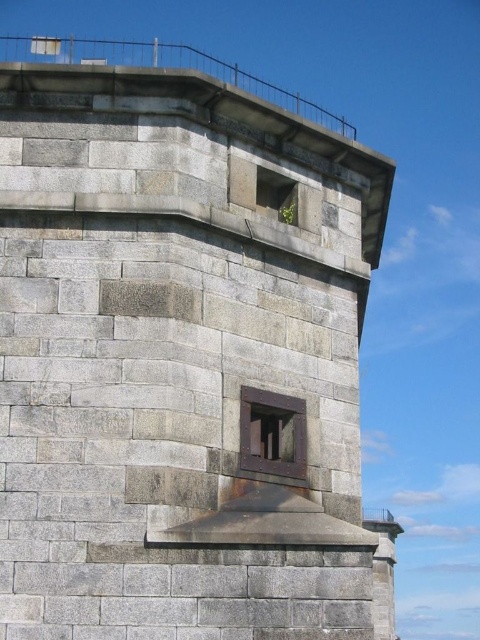
Question: Which point is closer to the camera taking this photo?

Choices:
 (A) (263, 173)
 (B) (252, 461)

Answer: (B)

Question: Can you confirm if rusty metal window at center is smaller than rusty metal window at upper center?

Choices:
 (A) no
 (B) yes

Answer: (A)

Question: Can you confirm if rusty metal window at center is positioned to the right of rusty metal window at upper center?

Choices:
 (A) yes
 (B) no

Answer: (B)

Question: Is rusty metal window at center above rusty metal window at upper center?

Choices:
 (A) yes
 (B) no

Answer: (B)

Question: Which point appears closest to the camera in this image?

Choices:
 (A) (243, 461)
 (B) (288, 220)

Answer: (A)